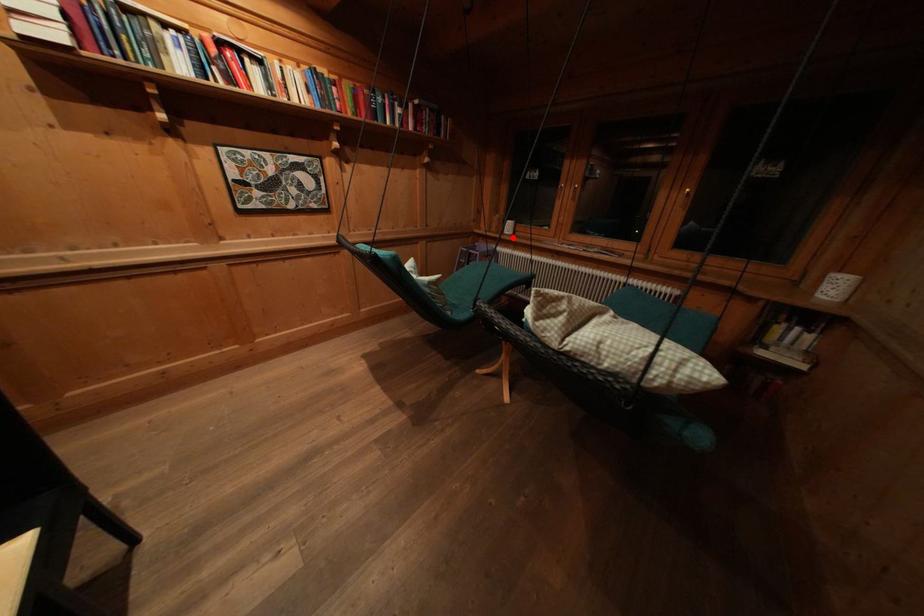
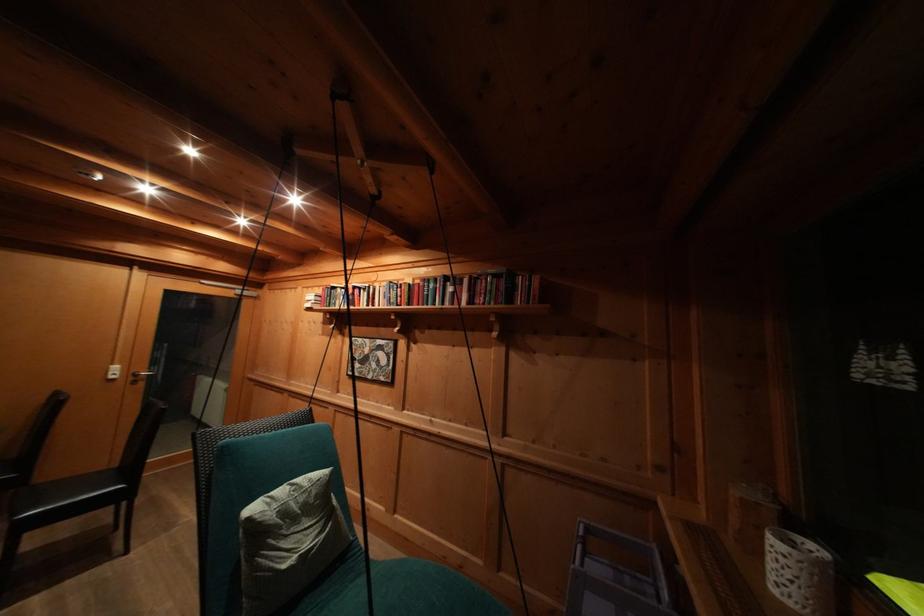
In the second image, find the point that corresponds to the highlighted location in the first image.

(780, 594)